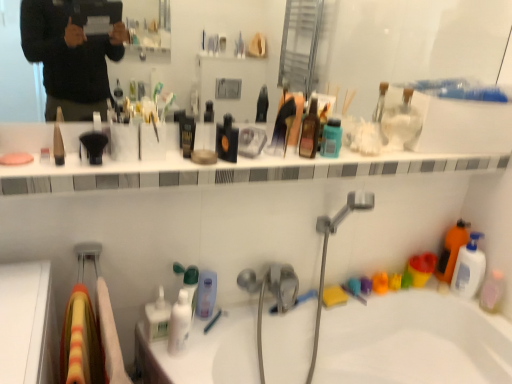
Question: From the image's perspective, is orange matte bottle at right, the 2th cleaning product from the top, on top of shiny brown bottle at center, the 2th cleaning product from the right?

Choices:
 (A) no
 (B) yes

Answer: (A)

Question: Does orange matte bottle at right, arranged as the 1th cleaning product when viewed from the back, have a greater width compared to shiny brown bottle at center, acting as the 1th cleaning product starting from the top?

Choices:
 (A) no
 (B) yes

Answer: (B)

Question: From the image's perspective, is orange matte bottle at right, arranged as the 1th cleaning product when viewed from the back, located beneath shiny brown bottle at center, the 3th cleaning product in the back-to-front sequence?

Choices:
 (A) no
 (B) yes

Answer: (B)

Question: Is orange matte bottle at right, the 3th cleaning product positioned from the left, next to shiny brown bottle at center, which is the second cleaning product from left to right?

Choices:
 (A) no
 (B) yes

Answer: (A)

Question: Can you confirm if orange matte bottle at right, the 1th cleaning product viewed from the right, is bigger than shiny brown bottle at center, the 3th cleaning product when ordered from bottom to top?

Choices:
 (A) no
 (B) yes

Answer: (B)

Question: Is shiny brown bottle at center, the 1th cleaning product in the front-to-back sequence, completely or partially inside orange matte bottle at right, the 1th cleaning product viewed from the right?

Choices:
 (A) yes
 (B) no

Answer: (B)

Question: Is white glossy jar at upper center, placed as the 1th toiletry when sorted from top to bottom, behind white glossy pump bottle at lower center, marked as the fifth toiletry in a top-to-bottom arrangement?

Choices:
 (A) no
 (B) yes

Answer: (B)

Question: Considering the relative sizes of white glossy jar at upper center, which is the 6th toiletry in left-to-right order, and white glossy pump bottle at lower center, the second toiletry when ordered from bottom to top, in the image provided, is white glossy jar at upper center, which is the 6th toiletry in left-to-right order, smaller than white glossy pump bottle at lower center, the second toiletry when ordered from bottom to top,?

Choices:
 (A) yes
 (B) no

Answer: (B)

Question: Can you confirm if white glossy jar at upper center, which is the 6th toiletry in left-to-right order, is positioned to the right of white glossy pump bottle at lower center, the second toiletry in the left-to-right sequence?

Choices:
 (A) no
 (B) yes

Answer: (B)

Question: Does white glossy jar at upper center, which is the 6th toiletry in left-to-right order, have a larger size compared to white glossy pump bottle at lower center, the second toiletry when ordered from bottom to top?

Choices:
 (A) no
 (B) yes

Answer: (B)

Question: Is white glossy jar at upper center, placed as the 1th toiletry when sorted from top to bottom, to the left of white glossy pump bottle at lower center, marked as the fifth toiletry in a top-to-bottom arrangement, from the viewer's perspective?

Choices:
 (A) no
 (B) yes

Answer: (A)

Question: Is white glossy jar at upper center, which is the 6th toiletry in left-to-right order, thinner than white glossy pump bottle at lower center, which is the fifth toiletry from right to left?

Choices:
 (A) yes
 (B) no

Answer: (B)

Question: From the image's perspective, is orange matte bottle at right, arranged as the second cleaning product when ordered from the bottom, located above matte black pencil at upper left, the 3th toiletry positioned from the top?

Choices:
 (A) no
 (B) yes

Answer: (A)